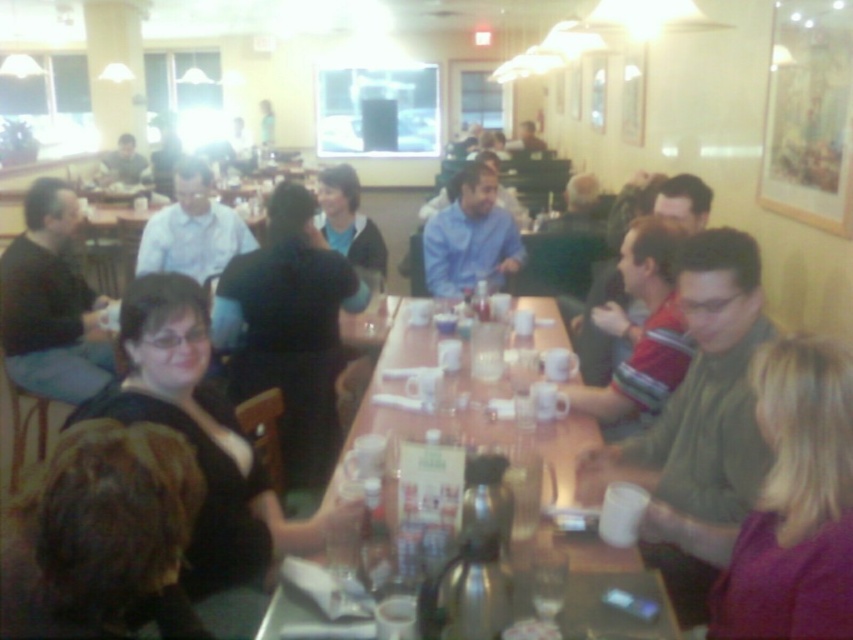
Question: Which object is positioned farthest from the matte black shirt at upper left?

Choices:
 (A) blue shirt at center
 (B) white shirt at center
 (C) matte black shirt at left

Answer: (C)

Question: Is matte black shirt at left to the left of matte black jacket at center from the viewer's perspective?

Choices:
 (A) yes
 (B) no

Answer: (A)

Question: Does matte black jacket at center have a smaller size compared to matte black shirt at upper left?

Choices:
 (A) no
 (B) yes

Answer: (B)

Question: Which point is closer to the camera?

Choices:
 (A) (198, 228)
 (B) (325, 244)

Answer: (B)

Question: In this image, where is matte black shirt at left located relative to matte black jacket at center?

Choices:
 (A) left
 (B) right

Answer: (A)

Question: Which point is farther to the camera?

Choices:
 (A) (143, 600)
 (B) (61, 374)
 (C) (132, 177)
 (D) (479, 204)

Answer: (C)